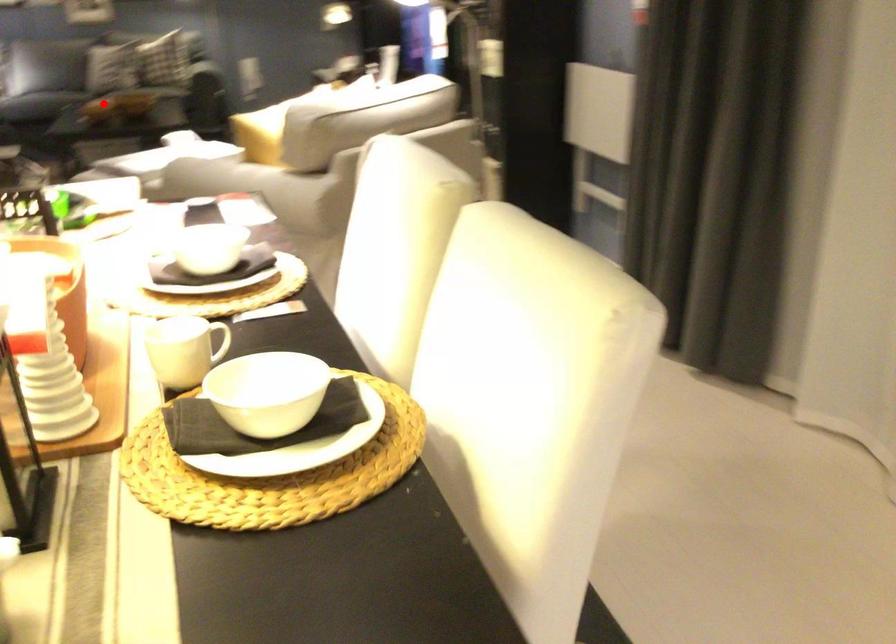
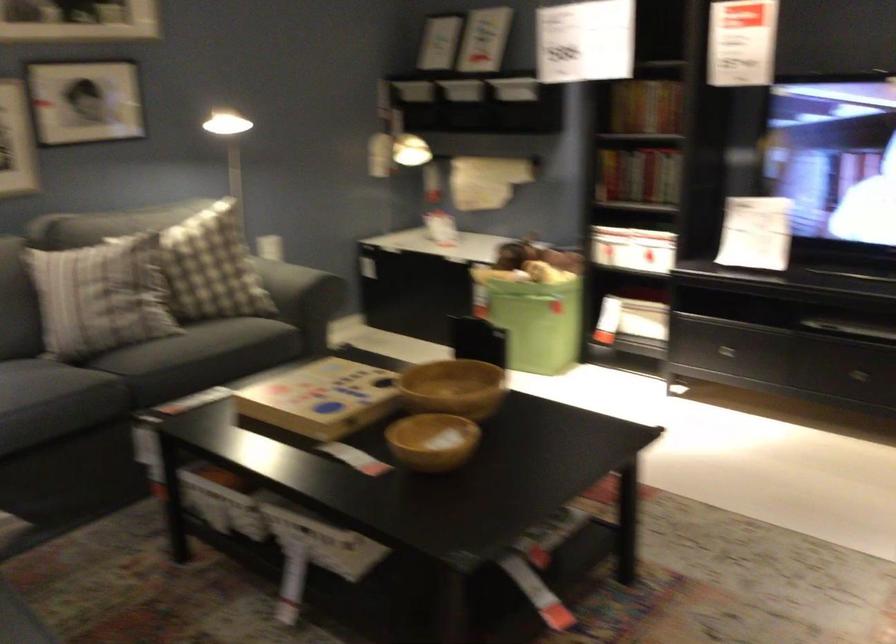
Locate, in the second image, the point that corresponds to the highlighted location in the first image.

(433, 440)